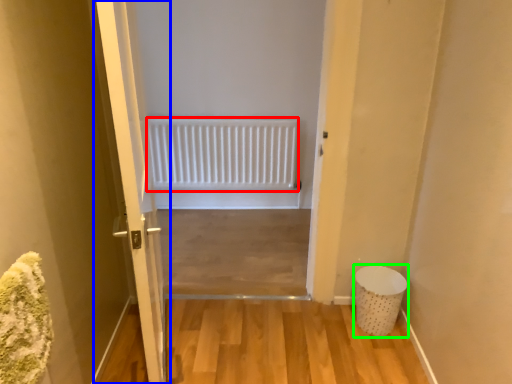
Question: Considering the real-world distances, which object is closest to radiator (highlighted by a red box)? door (highlighted by a blue box) or laundry basket (highlighted by a green box).

Choices:
 (A) door
 (B) laundry basket

Answer: (B)